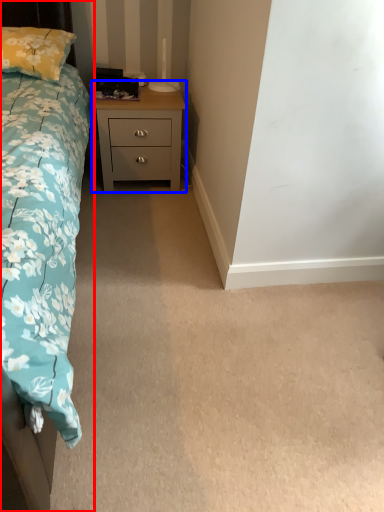
Question: Which object is closer to the camera taking this photo, bed (highlighted by a red box) or nightstand (highlighted by a blue box)?

Choices:
 (A) bed
 (B) nightstand

Answer: (A)